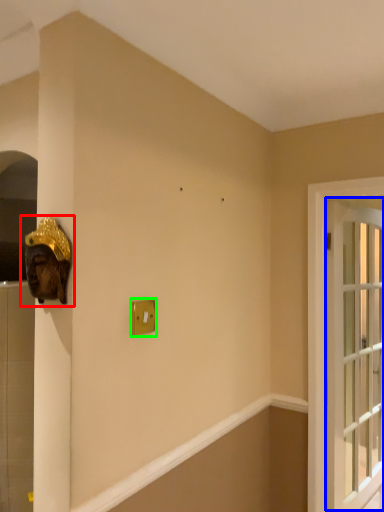
Question: Which object is the closest to the sculpture (highlighted by a red box)? Choose among these: window (highlighted by a blue box) or light switch (highlighted by a green box).

Choices:
 (A) window
 (B) light switch

Answer: (B)